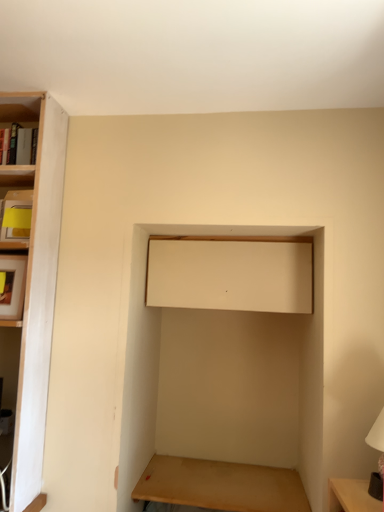
Question: Is white glossy table lamp at lower right situated inside beige matte cabinet at upper center or outside?

Choices:
 (A) outside
 (B) inside

Answer: (A)

Question: Is white glossy table lamp at lower right in front of or behind beige matte cabinet at upper center in the image?

Choices:
 (A) behind
 (B) front

Answer: (B)

Question: Which object is positioned farthest from the beige matte cabinet at upper center?

Choices:
 (A) wooden table at lower center
 (B) white glossy table lamp at lower right

Answer: (A)

Question: Which object is the closest to the wooden table at lower center?

Choices:
 (A) white glossy table lamp at lower right
 (B) beige matte cabinet at upper center

Answer: (A)